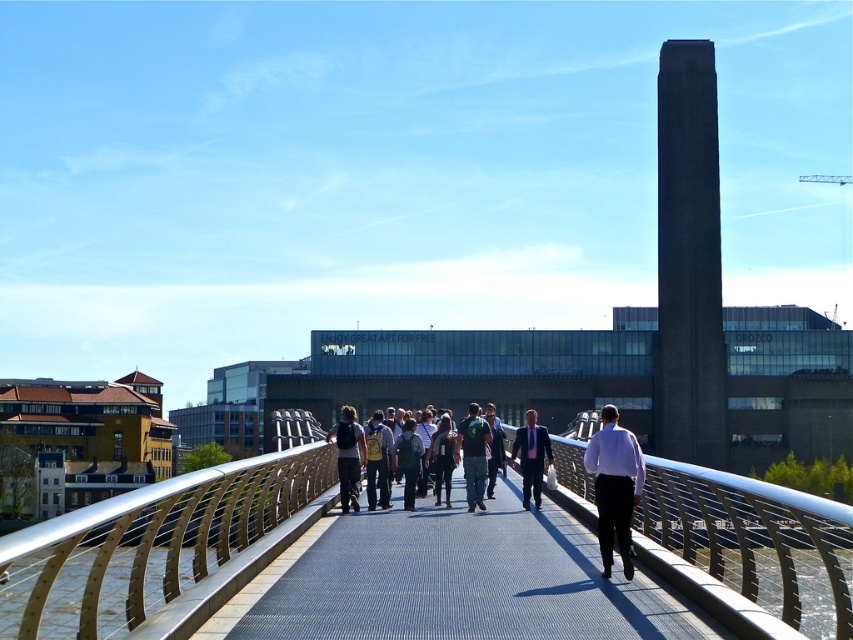
You are a photographer standing on the pedestrian bridge and want to capture both the matte black suit at center and the green fabric jacket at center in your photo. Which of the two items should you focus on first to ensure both are in frame?

You should focus on the matte black suit at center first since it is located below the green fabric jacket at center, allowing both to be captured within the frame by adjusting the camera angle appropriately.

You are standing on the pedestrian bridge and want to take a photo of the Tate Modern building in the background. There are two objects in your viewfinder, the satin silver railing at center and the matte black backpack at center. Which object should you move closer to or further away from to ensure the Tate Modern is clearly visible in your photo?

To ensure the Tate Modern is clearly visible, you should move further away from the satin silver railing at center since it is closer to the viewer and blocking the background. Alternatively, move closer to the matte black backpack at center to reduce its prominence in the foreground.

You are a photographer standing on the pedestrian bridge in London, aiming to capture the Tate Modern in the background. You notice a green fabric backpack at center and a matte black suit at center. Which item is narrower when viewed from your position?

The green fabric backpack at center is narrower than the matte black suit at center.